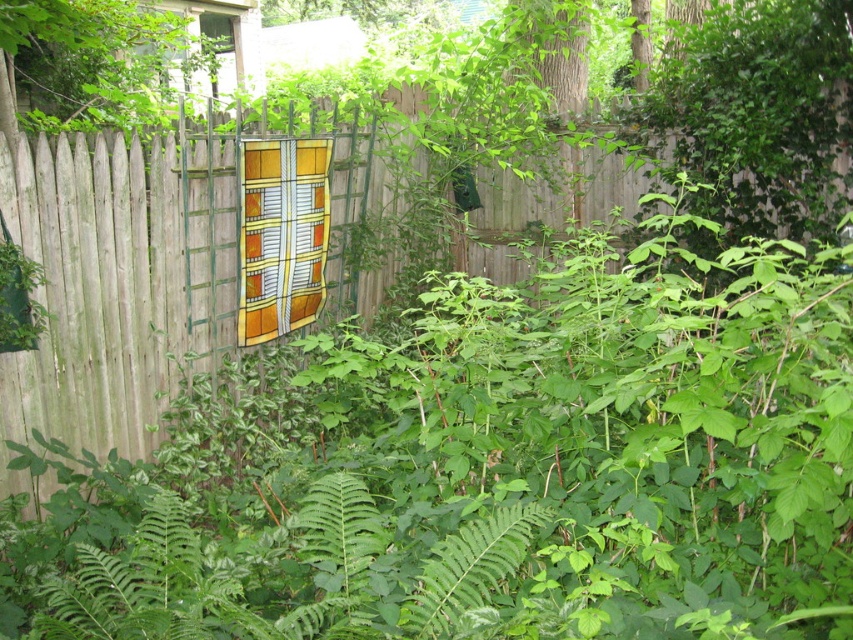
You are standing in the backyard and want to take a photo of the wooden fence at center and the green leafy tree at upper left. Which object should you focus on first if you want to capture both in a single frame without moving the camera?

You should focus on the wooden fence at center first because it is closer to you than the green leafy tree at upper left, which is further away.

You are a gardener planning to install a new sprinkler system. The sprinkler has a maximum reach of 10 feet. If you position the sprinkler at the base of the green leafy tree at upper left, will it be able to water the transparent glass window at upper center?

The distance between the green leafy tree at upper left and the transparent glass window at upper center is 12.72 feet, which exceeds the sprinkler system maximum reach of 10 feet. Therefore, the sprinkler will not be able to water the transparent glass window at upper center.